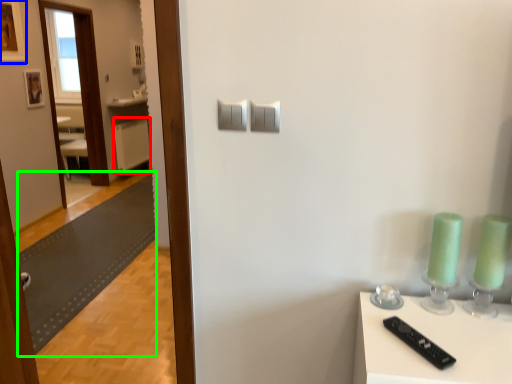
Question: Estimate the real-world distances between objects in this image. Which object is farther from radiator (highlighted by a red box), picture frame (highlighted by a blue box) or mat (highlighted by a green box)?

Choices:
 (A) picture frame
 (B) mat

Answer: (A)